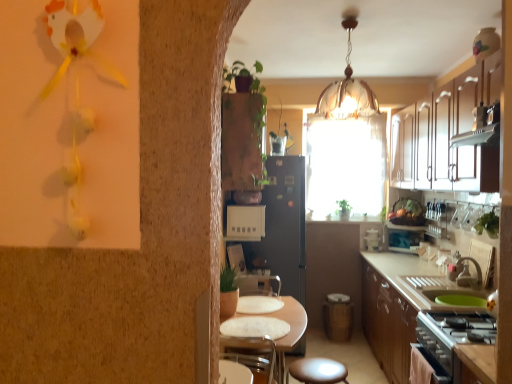
The width and height of the screenshot is (512, 384). Describe the element at coordinates (288, 323) in the screenshot. I see `white textured table at center` at that location.

Measure the distance between wooden counter top at lower right and camera.

1.52 meters.

What is the approximate height of green leafy plant at center, arranged as the second plant when ordered from the bottom?

98.34 centimeters.

In order to face stainless steel stove at lower right, should I rotate leftwards or rightwards?

Rotate your view right by about 27.024°.

The image size is (512, 384). Find the location of `stainless steel stove at lower right`. stainless steel stove at lower right is located at coordinates (451, 339).

This screenshot has width=512, height=384. Describe the element at coordinates (245, 222) in the screenshot. I see `beige plastic electrical outlet at center, the 1th appliance from the front` at that location.

Describe the element at coordinates (488, 224) in the screenshot. Image resolution: width=512 pixels, height=384 pixels. I see `green leafy plant at right, marked as the first plant in a front-to-back arrangement` at that location.

Image resolution: width=512 pixels, height=384 pixels. Find the location of `translucent glass chandelier at upper center`. translucent glass chandelier at upper center is located at coordinates (347, 86).

What do you see at coordinates (347, 86) in the screenshot? I see `translucent glass chandelier at upper center` at bounding box center [347, 86].

In order to click on white textured table at center in this screenshot , I will do `click(288, 323)`.

Is white glossy countertop at lower right outside of matte black microwave at right, the first appliance ordered from the bottom?

Yes.

Are white glossy countertop at lower right and matte black microwave at right, acting as the 2th appliance starting from the front, making contact?

They are not placed beside each other.

Looking at this image, from a real-world perspective, is white glossy countertop at lower right positioned under matte black microwave at right, the first appliance ordered from the bottom, based on gravity?

Yes, from a real-world perspective, white glossy countertop at lower right is under matte black microwave at right, the first appliance ordered from the bottom.

Considering the sizes of objects white glossy countertop at lower right and matte black microwave at right, acting as the 1th appliance starting from the back, in the image provided, who is wider, white glossy countertop at lower right or matte black microwave at right, acting as the 1th appliance starting from the back,?

With larger width is white glossy countertop at lower right.

Which of these two, matte black microwave at right, the first appliance positioned from the right, or matte brown stool at lower center, is smaller?

With smaller size is matte black microwave at right, the first appliance positioned from the right.

Is the position of matte black microwave at right, acting as the 1th appliance starting from the back, more distant than that of matte brown stool at lower center?

Yes.

Would you say matte black microwave at right, positioned as the second appliance in top-to-bottom order, is outside matte brown stool at lower center?

Absolutely, matte black microwave at right, positioned as the second appliance in top-to-bottom order, is external to matte brown stool at lower center.

Is matte black microwave at right, acting as the 2th appliance starting from the front, next to matte brown stool at lower center and touching it?

matte black microwave at right, acting as the 2th appliance starting from the front, and matte brown stool at lower center are not in contact.

Considering the relative positions of stainless steel stove at lower right and beige plastic electrical outlet at center, which appears as the second appliance when viewed from the back, in the image provided, is stainless steel stove at lower right to the left of beige plastic electrical outlet at center, which appears as the second appliance when viewed from the back, from the viewer's perspective?

No, stainless steel stove at lower right is not to the left of beige plastic electrical outlet at center, which appears as the second appliance when viewed from the back.

Looking at this image, from a real-world perspective, is stainless steel stove at lower right positioned above or below beige plastic electrical outlet at center, the second appliance positioned from the bottom?

In terms of real-world spatial position, stainless steel stove at lower right is below beige plastic electrical outlet at center, the second appliance positioned from the bottom.

Between stainless steel stove at lower right and beige plastic electrical outlet at center, the second appliance positioned from the bottom, which one has smaller width?

beige plastic electrical outlet at center, the second appliance positioned from the bottom.

What's the angular difference between stainless steel stove at lower right and beige plastic electrical outlet at center, the 1th appliance positioned from the left,'s facing directions?

The facing directions of stainless steel stove at lower right and beige plastic electrical outlet at center, the 1th appliance positioned from the left, are 178 degrees apart.

This screenshot has height=384, width=512. Identify the location of kitchen appliance beneath the matte black microwave at right, which is counted as the 2th appliance, starting from the left (from a real-world perspective). (451, 339).

Is stainless steel stove at lower right located within matte black microwave at right, the first appliance positioned from the right?

No, stainless steel stove at lower right is not inside matte black microwave at right, the first appliance positioned from the right.

Who is shorter, matte black microwave at right, the first appliance positioned from the right, or stainless steel stove at lower right?

Standing shorter between the two is stainless steel stove at lower right.

Is point (424, 231) positioned before point (472, 322)?

No, (424, 231) is behind (472, 322).

From the image's perspective, is wooden counter top at lower right located beneath white textured table at center?

No, from the image's perspective, wooden counter top at lower right is not beneath white textured table at center.

Is wooden counter top at lower right looking in the opposite direction of white textured table at center?

wooden counter top at lower right does not have its back to white textured table at center.

Is wooden counter top at lower right beside white textured table at center?

No, wooden counter top at lower right is not in contact with white textured table at center.

From the picture: From the image's perspective, who appears lower, black matte refrigerator at center or stainless steel stove at lower right?

From the image's view, stainless steel stove at lower right is below.

Consider the image. Considering the sizes of objects black matte refrigerator at center and stainless steel stove at lower right in the image provided, who is taller, black matte refrigerator at center or stainless steel stove at lower right?

Standing taller between the two is black matte refrigerator at center.

Considering the positions of points (286, 178) and (476, 315), is point (286, 178) closer to camera compared to point (476, 315)?

That is False.

Considering the sizes of objects black matte refrigerator at center and stainless steel stove at lower right in the image provided, who is smaller, black matte refrigerator at center or stainless steel stove at lower right?

stainless steel stove at lower right is smaller.

Who is more distant, black matte refrigerator at center or green leafy plant at center, the second plant when ordered from right to left?

black matte refrigerator at center is further from the camera.

Can you tell me how much black matte refrigerator at center and green leafy plant at center, the 1th plant from the top, differ in facing direction?

The facing directions of black matte refrigerator at center and green leafy plant at center, the 1th plant from the top, are 92 degrees apart.

Considering the sizes of objects black matte refrigerator at center and green leafy plant at center, arranged as the second plant when ordered from the bottom, in the image provided, who is wider, black matte refrigerator at center or green leafy plant at center, arranged as the second plant when ordered from the bottom,?

With larger width is black matte refrigerator at center.

Does black matte refrigerator at center contain green leafy plant at center, the 1th plant from the top?

No, green leafy plant at center, the 1th plant from the top, is not inside black matte refrigerator at center.

Find the location of a particular element. countertop below the matte black microwave at right, acting as the 2th appliance starting from the front (from a real-world perspective) is located at coordinates (398, 306).

From a real-world perspective, which appliance is the 1st one above the matte brown stool at lower center? Please provide its 2D coordinates.

[(404, 237)]

Estimate the real-world distances between objects in this image. Which object is closer to wooden counter top at lower right, green plastic sink at lower right or beige plastic electrical outlet at center, the second appliance positioned from the bottom?

The object closer to wooden counter top at lower right is green plastic sink at lower right.

Based on their spatial positions, is stainless steel stove at lower right or wooden counter top at lower right further from green plastic sink at lower right?

The object further to green plastic sink at lower right is wooden counter top at lower right.

Considering their positions, is matte brown stool at lower center positioned further to wooden counter top at lower right than beige plastic electrical outlet at center, the second appliance positioned from the bottom?

Among the two, beige plastic electrical outlet at center, the second appliance positioned from the bottom, is located further to wooden counter top at lower right.

Estimate the real-world distances between objects in this image. Which object is closer to black matte refrigerator at center, matte brown stool at lower center or matte black microwave at right, the first appliance ordered from the bottom?

Among the two, matte black microwave at right, the first appliance ordered from the bottom, is located nearer to black matte refrigerator at center.

Based on their spatial positions, is beige plastic electrical outlet at center, the 1th appliance from the front, or white glossy cabinet at upper right further from green leafy plant at center, arranged as the second plant when ordered from the bottom?

The object further to green leafy plant at center, arranged as the second plant when ordered from the bottom, is white glossy cabinet at upper right.

Estimate the real-world distances between objects in this image. Which object is closer to matte black microwave at right, the first appliance positioned from the right, beige plastic electrical outlet at center, the first appliance viewed from the top, or matte brown stool at lower center?

Based on the image, beige plastic electrical outlet at center, the first appliance viewed from the top, appears to be nearer to matte black microwave at right, the first appliance positioned from the right.

From the image, which object appears to be farther from matte brown stool at lower center, stainless steel stove at lower right or white textured table at center?

stainless steel stove at lower right.

Consider the image. From the image, which object appears to be farther from green leafy plant at center, the first plant viewed from the left, white glossy cabinet at upper right or matte brown stool at lower center?

matte brown stool at lower center.

Locate an element on the screen. The width and height of the screenshot is (512, 384). table between green leafy plant at center, the first plant viewed from the left, and white glossy countertop at lower right vertically is located at coordinates (288, 323).

Locate an element on the screen. appliance located between green leafy plant at center, which is counted as the 1th plant, starting from the back, and matte black microwave at right, positioned as the second appliance in top-to-bottom order, in the left-right direction is located at coordinates (245, 222).

Where is `light fixture between stainless steel stove at lower right and matte black microwave at right, the first appliance ordered from the bottom, in the front-back direction`? The height and width of the screenshot is (384, 512). light fixture between stainless steel stove at lower right and matte black microwave at right, the first appliance ordered from the bottom, in the front-back direction is located at coordinates (347, 86).

Locate an element on the screen. The height and width of the screenshot is (384, 512). kitchen appliance between green leafy plant at center, arranged as the second plant when ordered from the bottom, and white glossy countertop at lower right, in the vertical direction is located at coordinates (451, 339).